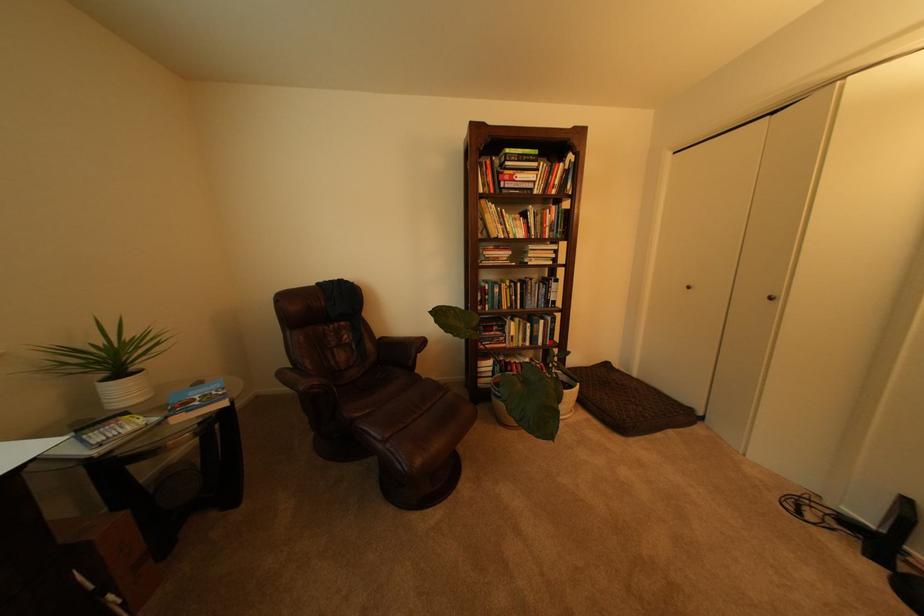
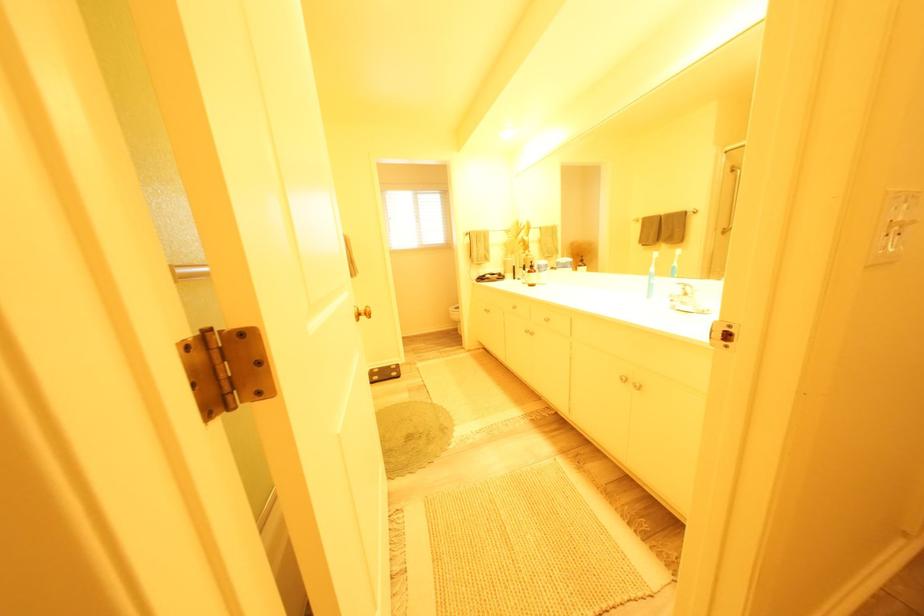
Question: What movement of the cameraman would produce the second image?

Choices:
 (A) Left
 (B) Right
 (C) Forward
 (D) Backward

Answer: (B)